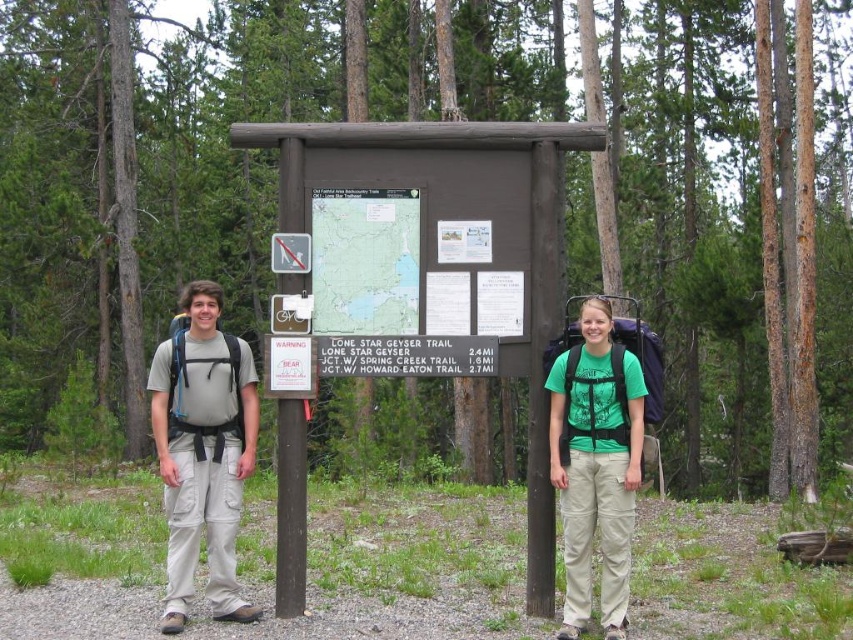
Question: Does matte gray backpack at left have a smaller size compared to paper map at center?

Choices:
 (A) yes
 (B) no

Answer: (B)

Question: Observing the image, what is the correct spatial positioning of matte gray backpack at left in reference to green cotton t-shirt at center?

Choices:
 (A) above
 (B) below

Answer: (B)

Question: Does matte gray backpack at left appear over green cotton t-shirt at center?

Choices:
 (A) yes
 (B) no

Answer: (B)

Question: Which of the following is the closest to the observer?

Choices:
 (A) (381, 332)
 (B) (625, 474)
 (C) (230, 488)

Answer: (B)

Question: Which object is farther from the camera taking this photo?

Choices:
 (A) green cotton t-shirt at center
 (B) matte gray backpack at left

Answer: (A)

Question: Which of the following is the closest to the observer?

Choices:
 (A) (218, 596)
 (B) (386, 195)
 (C) (235, 465)

Answer: (C)